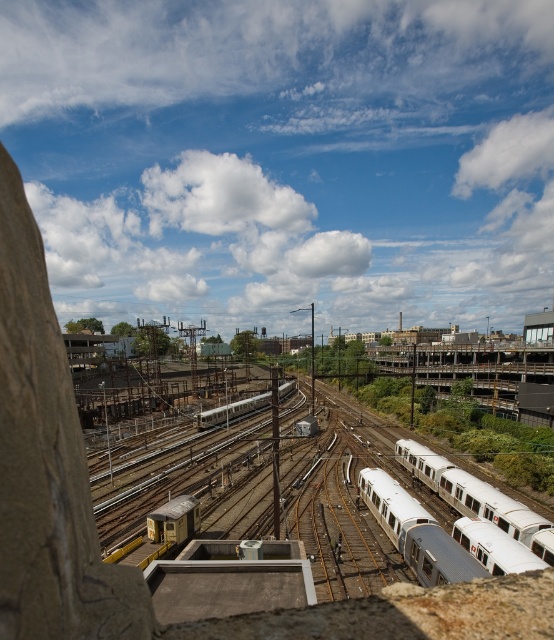
Image resolution: width=554 pixels, height=640 pixels. Describe the element at coordinates (469, 492) in the screenshot. I see `silver metallic train at right` at that location.

Between point (402, 464) and point (202, 420), which one is positioned in front?

Point (402, 464)

Locate an element on the screen. This screenshot has height=640, width=554. silver metallic train at right is located at coordinates (469, 492).